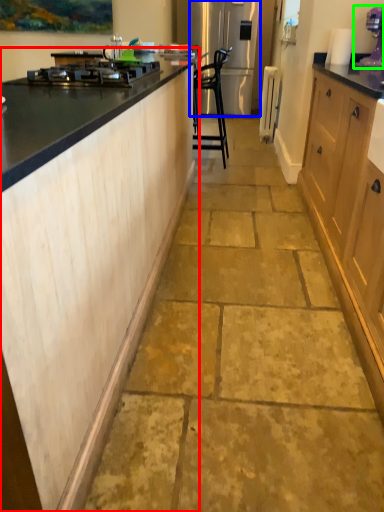
Question: Which object is positioned closest to cabinetry (highlighted by a red box)? Select from refrigerator (highlighted by a blue box) and kitchen appliance (highlighted by a green box).

Choices:
 (A) refrigerator
 (B) kitchen appliance

Answer: (B)